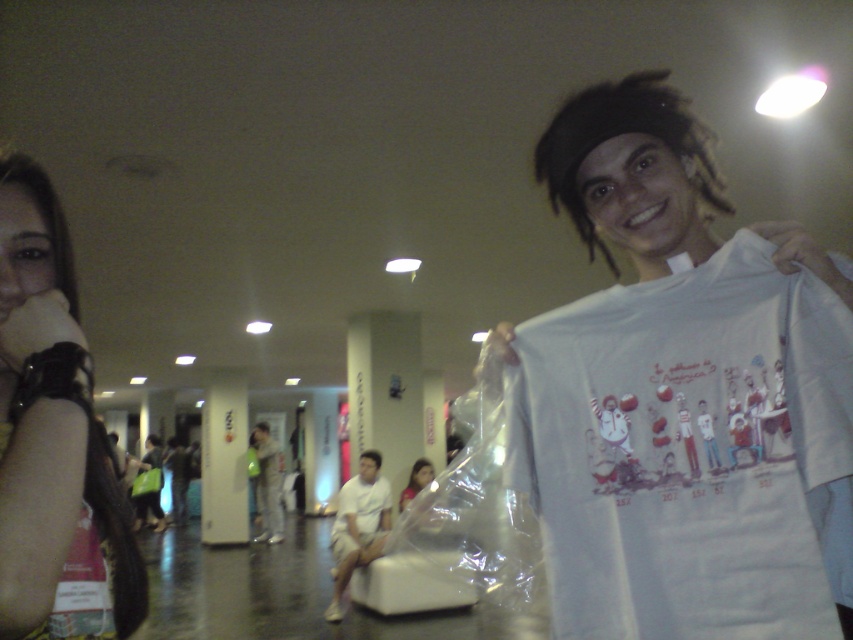
Question: Does white cotton t-shirt at right appear under matte pink shirt at center?

Choices:
 (A) yes
 (B) no

Answer: (B)

Question: Is white cotton shirt at center bigger than light brown fabric pants at center?

Choices:
 (A) no
 (B) yes

Answer: (B)

Question: Among these objects, which one is farthest from the camera?

Choices:
 (A) white cotton t-shirt at right
 (B) white cotton shirt at center
 (C) black leather bracelet at upper left

Answer: (B)

Question: Which of the following is the closest to the observer?

Choices:
 (A) light brown fabric pants at center
 (B) matte pink shirt at center
 (C) white cotton t-shirt at right
 (D) white cotton shirt at center

Answer: (C)

Question: Can you confirm if white cotton shirt at center is bigger than matte pink shirt at center?

Choices:
 (A) yes
 (B) no

Answer: (A)

Question: Estimate the real-world distances between objects in this image. Which object is farther from the matte pink shirt at center?

Choices:
 (A) white cotton t-shirt at right
 (B) white cotton shirt at center
 (C) black leather bracelet at upper left
 (D) light brown fabric pants at center

Answer: (C)